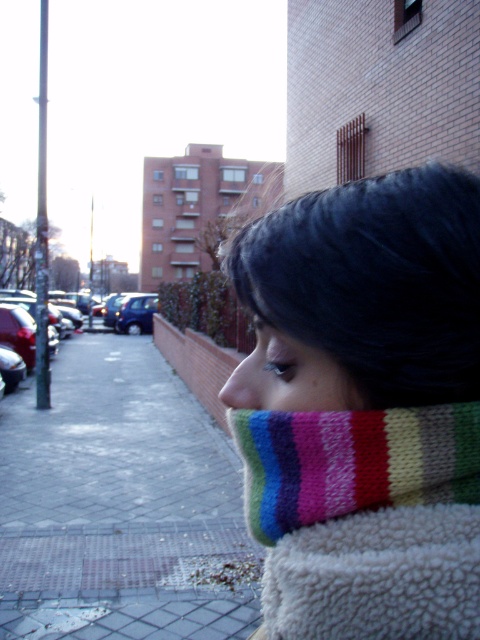
Question: Is gray brick pavement at lower left bigger than knitted multicolor scarf at lower right?

Choices:
 (A) yes
 (B) no

Answer: (A)

Question: Which object is positioned closest to the knitted multicolor scarf at lower right?

Choices:
 (A) gray brick pavement at lower left
 (B) multicolored knitted scarf at center
 (C) shiny blue sedan at center

Answer: (B)

Question: Which point is farther to the camera?

Choices:
 (A) (144, 307)
 (B) (351, 588)
 (C) (276, 392)

Answer: (A)

Question: Which point is farther from the camera taking this photo?

Choices:
 (A) (276, 412)
 (B) (243, 365)

Answer: (B)

Question: Is knitted multicolor scarf at lower right smaller than shiny blue sedan at center?

Choices:
 (A) no
 (B) yes

Answer: (B)

Question: Can you confirm if gray brick pavement at lower left is positioned below knitted multicolor scarf at lower right?

Choices:
 (A) yes
 (B) no

Answer: (A)